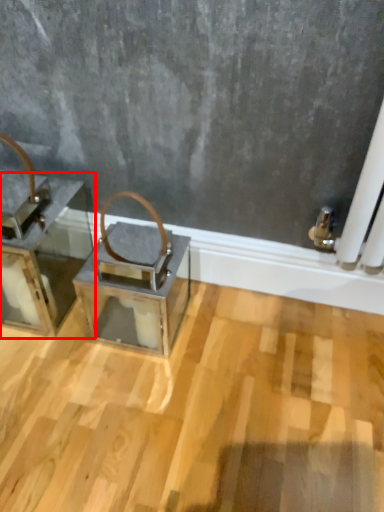
Question: From the image, what is the correct spatial relationship of furniture (annotated by the red box) in relation to table?

Choices:
 (A) left
 (B) right

Answer: (A)